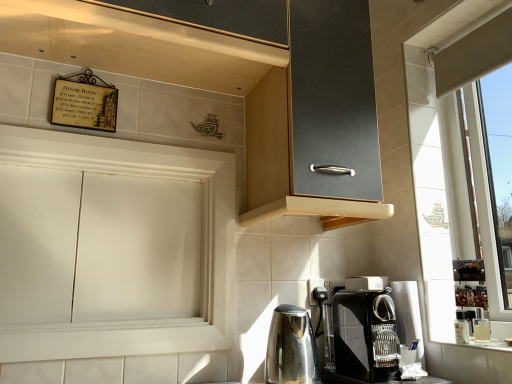
Question: Is white matte cabinet at left, the 2th cabinetry in the top-to-bottom sequence, spatially inside matte black cabinet at upper center, marked as the first cabinetry in a top-to-bottom arrangement, or outside of it?

Choices:
 (A) outside
 (B) inside

Answer: (A)

Question: Is point 148,193 closer or farther from the camera than point 372,170?

Choices:
 (A) farther
 (B) closer

Answer: (A)

Question: Based on their relative distances, which object is farther from the polished stainless steel kettle at lower center?

Choices:
 (A) black glossy coffee maker at lower right
 (B) matte black cabinet at upper center, the 2th cabinetry from the bottom
 (C) white matte cabinet at left, the 2th cabinetry in the top-to-bottom sequence

Answer: (B)

Question: Considering the real-world distances, which object is closest to the white matte cabinet at left, the 2th cabinetry in the top-to-bottom sequence?

Choices:
 (A) black glossy coffee maker at lower right
 (B) matte black cabinet at upper center, marked as the first cabinetry in a top-to-bottom arrangement
 (C) polished stainless steel kettle at lower center

Answer: (B)